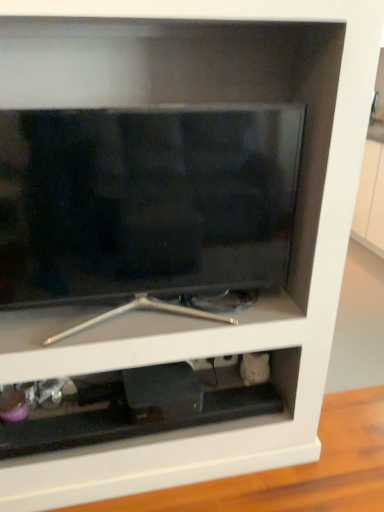
What do you see at coordinates (139, 403) in the screenshot? Image resolution: width=384 pixels, height=512 pixels. I see `black plastic cabinet at lower center` at bounding box center [139, 403].

Identify the location of black plastic cabinet at lower center. The height and width of the screenshot is (512, 384). (139, 403).

This screenshot has height=512, width=384. What are the coordinates of `matte black tv at center` in the screenshot? It's located at (145, 200).

This screenshot has width=384, height=512. What do you see at coordinates (145, 200) in the screenshot? I see `matte black tv at center` at bounding box center [145, 200].

Locate an element on the screen. black plastic cabinet at lower center is located at coordinates (x=139, y=403).

In the image, is matte black tv at center on the left side or the right side of black plastic cabinet at lower center?

Based on their positions, matte black tv at center is located to the right of black plastic cabinet at lower center.

Is matte black tv at center further to camera compared to black plastic cabinet at lower center?

That is False.

Between point (186, 288) and point (52, 383), which one is positioned in front?

Point (186, 288)

From the image's perspective, is matte black tv at center located beneath black plastic cabinet at lower center?

Actually, matte black tv at center appears above black plastic cabinet at lower center in the image.

From a real-world perspective, is matte black tv at center positioned over black plastic cabinet at lower center based on gravity?

Yes, from a real-world perspective, matte black tv at center is on top of black plastic cabinet at lower center.

Considering the relative sizes of matte black tv at center and black plastic cabinet at lower center in the image provided, is matte black tv at center wider than black plastic cabinet at lower center?

No.

Who is taller, matte black tv at center or black plastic cabinet at lower center?

Standing taller between the two is matte black tv at center.

Which of these two, matte black tv at center or black plastic cabinet at lower center, is bigger?

Bigger between the two is matte black tv at center.

Can we say matte black tv at center lies outside black plastic cabinet at lower center?

Yes, matte black tv at center is located beyond the bounds of black plastic cabinet at lower center.

Is matte black tv at center not near black plastic cabinet at lower center?

No.

Could you tell me if matte black tv at center is turned towards black plastic cabinet at lower center?

No, matte black tv at center is not oriented towards black plastic cabinet at lower center.

What's the angular difference between matte black tv at center and black plastic cabinet at lower center's facing directions?

The facing directions of matte black tv at center and black plastic cabinet at lower center are 0.144 degrees apart.

In order to click on cabinet located below the matte black tv at center (from the image's perspective) in this screenshot , I will do `click(139, 403)`.

Consider the image. Is black plastic cabinet at lower center at the left side of matte black tv at center?

Indeed, black plastic cabinet at lower center is positioned on the left side of matte black tv at center.

In the image, is black plastic cabinet at lower center positioned in front of or behind matte black tv at center?

Clearly, black plastic cabinet at lower center is behind matte black tv at center.

Which is in front, point (273, 376) or point (186, 234)?

Point (186, 234)

From the image's perspective, which is above, black plastic cabinet at lower center or matte black tv at center?

From the image's view, matte black tv at center is above.

From a real-world perspective, who is located higher, black plastic cabinet at lower center or matte black tv at center?

matte black tv at center.

In the scene shown: Considering the sizes of objects black plastic cabinet at lower center and matte black tv at center in the image provided, who is wider, black plastic cabinet at lower center or matte black tv at center?

With larger width is black plastic cabinet at lower center.

Is black plastic cabinet at lower center shorter than matte black tv at center?

Indeed, black plastic cabinet at lower center has a lesser height compared to matte black tv at center.

Considering the sizes of objects black plastic cabinet at lower center and matte black tv at center in the image provided, who is bigger, black plastic cabinet at lower center or matte black tv at center?

matte black tv at center is bigger.

Does black plastic cabinet at lower center contain matte black tv at center?

No, matte black tv at center is not inside black plastic cabinet at lower center.

Can you see black plastic cabinet at lower center touching matte black tv at center?

black plastic cabinet at lower center and matte black tv at center are clearly separated.

Is black plastic cabinet at lower center facing away from matte black tv at center?

No.

You are a GUI agent. You are given a task and a screenshot of the screen. Output one action in this format:
    pyautogui.click(x=<x>, y=<y>)
    Task: Click on the television above the black plastic cabinet at lower center (from the image's perspective)
    This screenshot has height=512, width=384.
    Given the screenshot: What is the action you would take?
    pyautogui.click(x=145, y=200)

Locate an element on the screen. cabinet below the matte black tv at center (from a real-world perspective) is located at coordinates (139, 403).

The width and height of the screenshot is (384, 512). In the image, there is a matte black tv at center. Find the location of `cabinet below it (from the image's perspective)`. cabinet below it (from the image's perspective) is located at coordinates (139, 403).